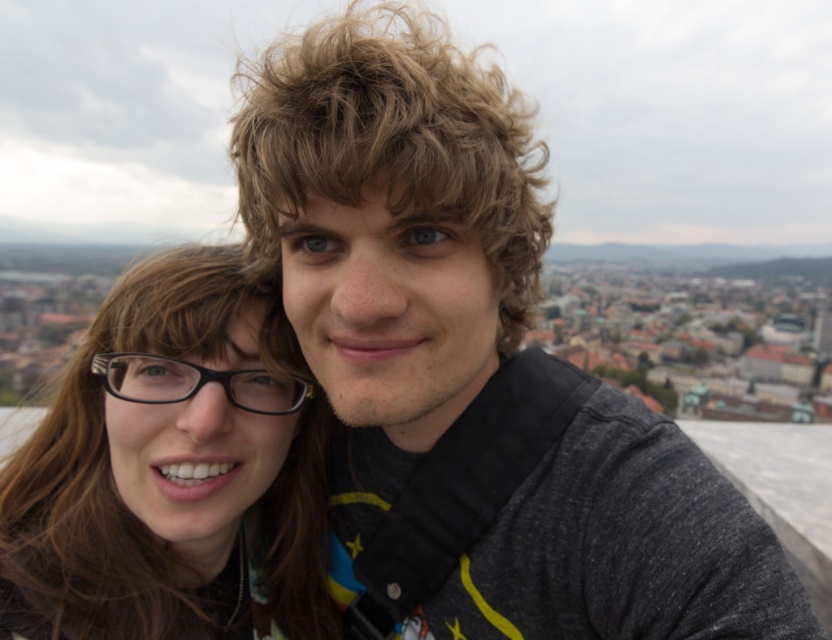
Question: Which object appears farthest from the camera in this image?

Choices:
 (A) matte black glasses at left
 (B) gray fabric jacket at center

Answer: (A)

Question: Does gray fabric jacket at center have a smaller size compared to matte black glasses at left?

Choices:
 (A) no
 (B) yes

Answer: (A)

Question: Can you confirm if gray fabric jacket at center is thinner than matte black glasses at left?

Choices:
 (A) yes
 (B) no

Answer: (B)

Question: Which object is farther from the camera taking this photo?

Choices:
 (A) gray fabric jacket at center
 (B) matte black glasses at left

Answer: (B)

Question: From the image, what is the correct spatial relationship of gray fabric jacket at center in relation to matte black glasses at left?

Choices:
 (A) above
 (B) below

Answer: (A)